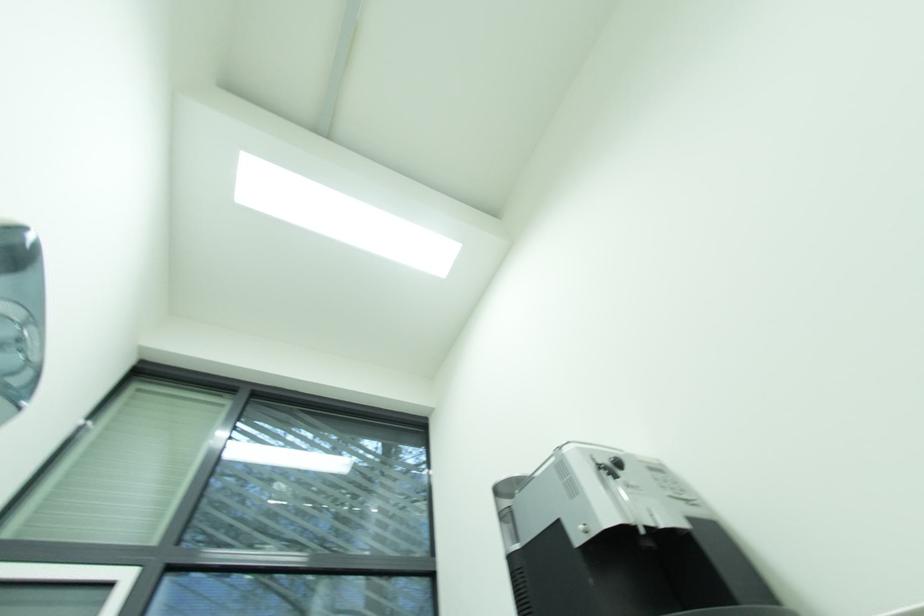
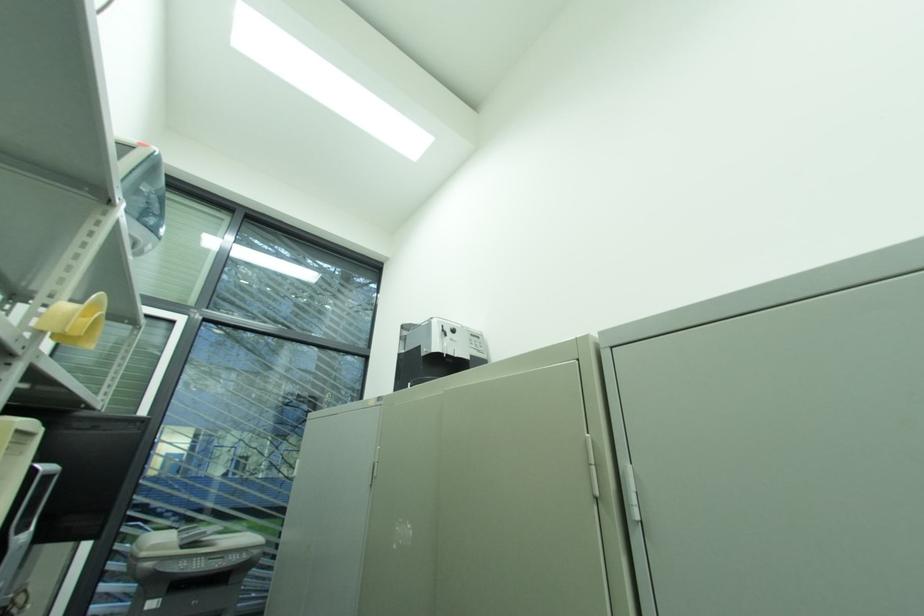
Question: Based on the continuous images, in which direction is the camera rotating? Reply with the corresponding letter.

Choices:
 (A) Left
 (B) Right
 (C) Up
 (D) Down

Answer: (D)